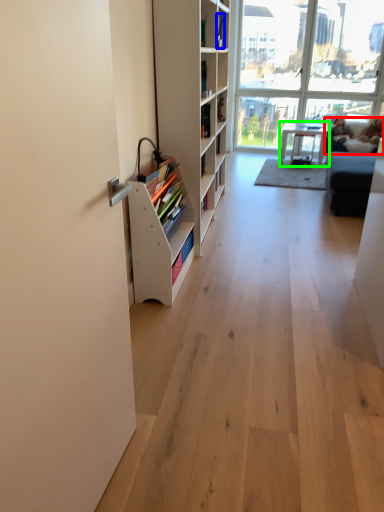
Question: Which is farther away from couch (highlighted by a red box)? book (highlighted by a blue box) or table (highlighted by a green box)?

Choices:
 (A) book
 (B) table

Answer: (A)